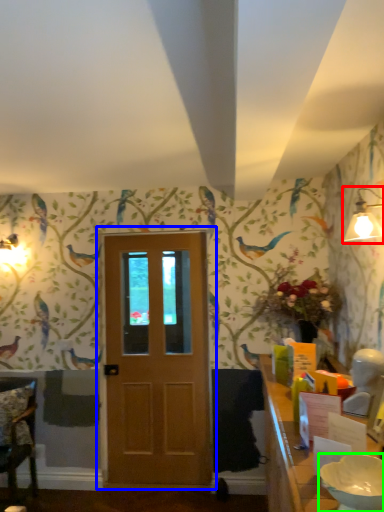
Question: Estimate the real-world distances between objects in this image. Which object is farther from light fixture (highlighted by a red box), door (highlighted by a blue box) or bowl (highlighted by a green box)?

Choices:
 (A) door
 (B) bowl

Answer: (A)